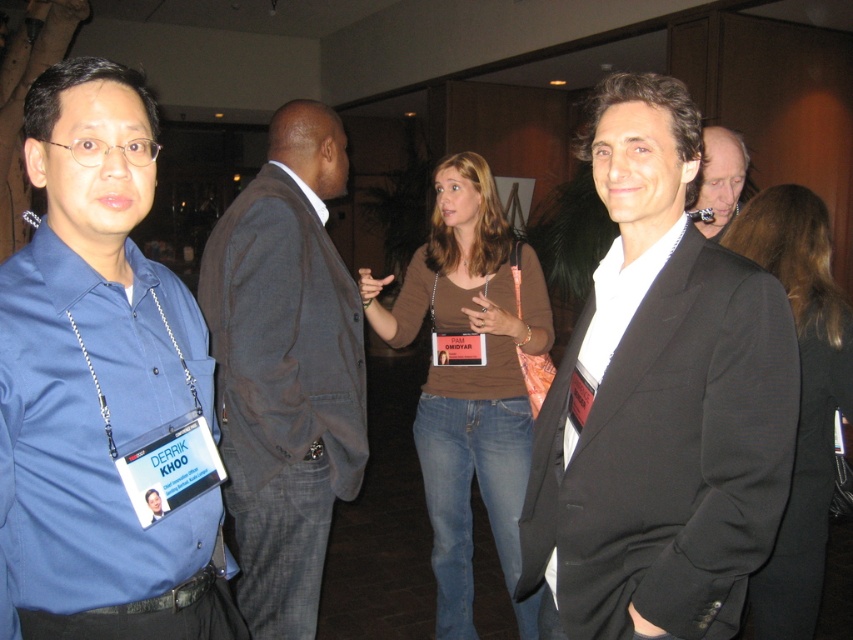
You are at a social event and need to approach the dark brown suit at center and the brown leather jacket at center. Which one should you walk towards first if you want to greet the person closest to you?

You should first greet the dark brown suit at center because it is closer to you than the brown leather jacket at center.

You are organizing a charity event and need to arrange seating based on the height of the guests. You have two guests wearing a dark brown suit at center and a smooth gray suit at right. Which guest should you seat first to accommodate their height?

The dark brown suit at center has a greater height compared to the smooth gray suit at right, so you should seat the guest in the dark brown suit at center first to accommodate their height.

You are at a networking event and want to approach the dark brown suit at center and the smooth gray suit at right. Which one should you walk towards first if you want to greet them in the order they are positioned from closest to farthest?

You should first greet the dark brown suit at center because it is closer to you than the smooth gray suit at right, which is farther away.